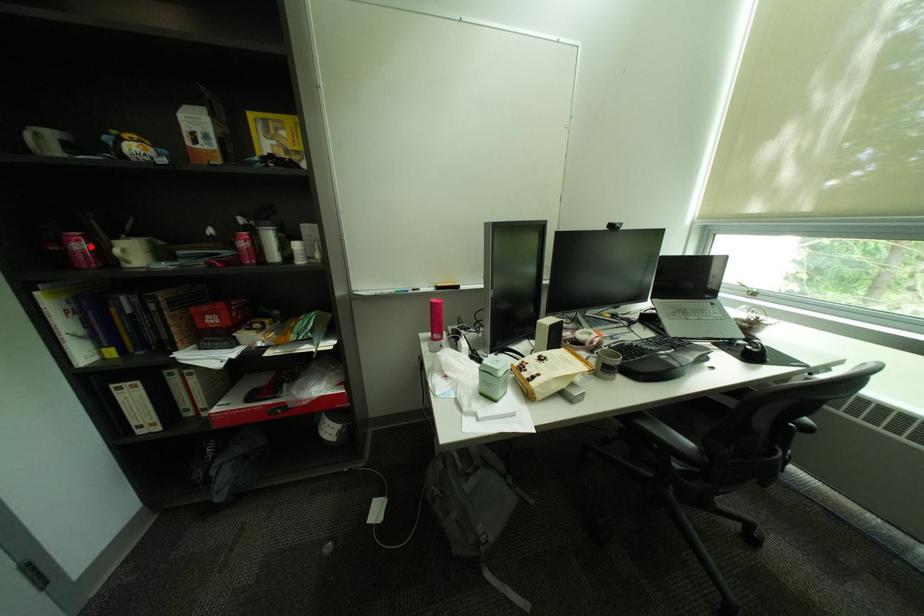
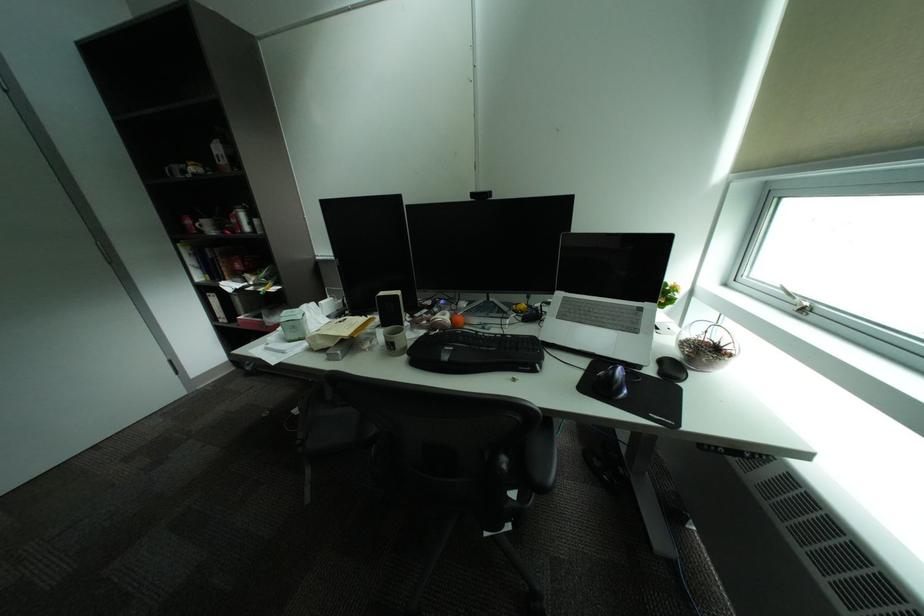
Find the pixel in the second image that matches the highlighted location in the first image.

(199, 223)